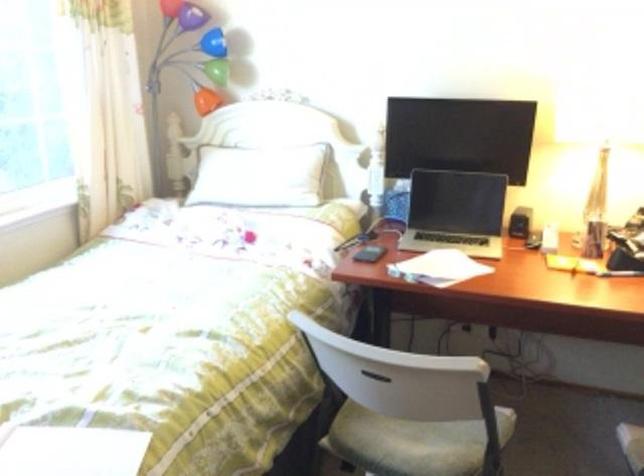
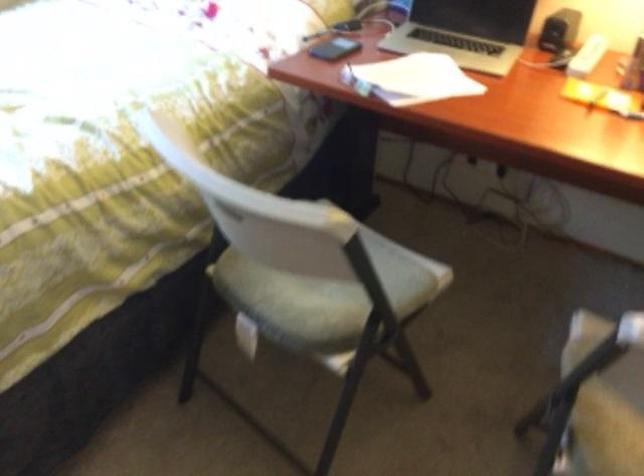
Locate, in the second image, the point that corresponds to the point at 527,219 in the first image.

(559, 30)